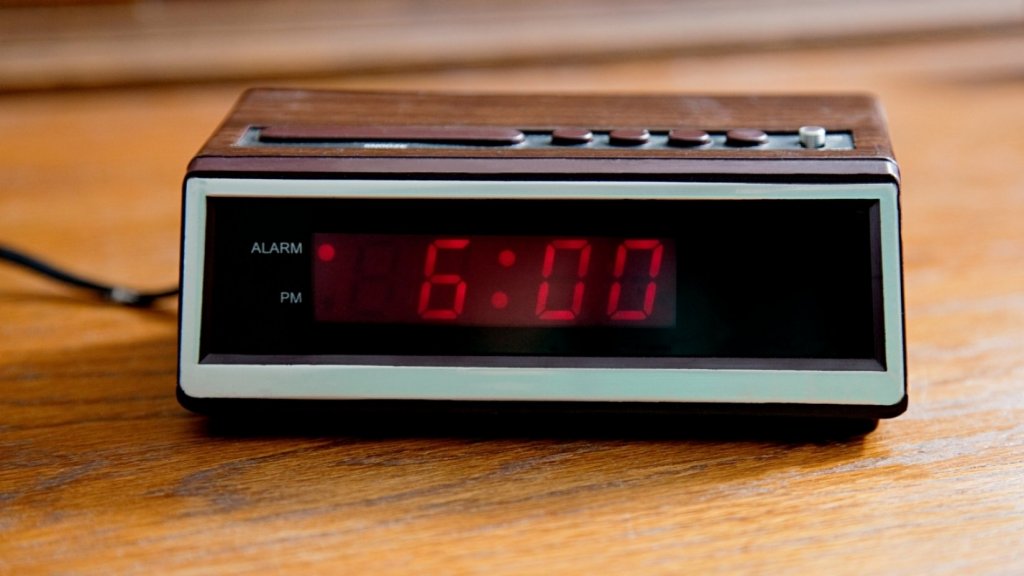
This screenshot has width=1024, height=576. In order to click on red digital dot showing alarm is set in this screenshot , I will do `click(322, 249)`.